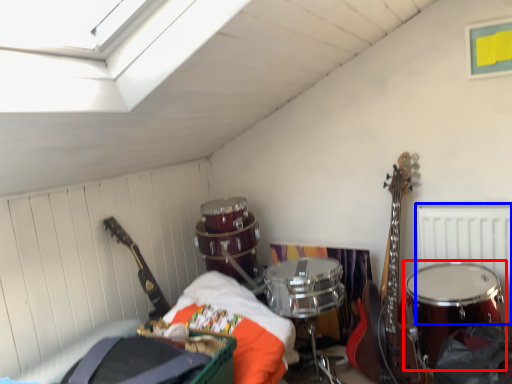
Question: Among these objects, which one is farthest to the camera, drum (highlighted by a red box) or radiator (highlighted by a blue box)?

Choices:
 (A) drum
 (B) radiator

Answer: (B)